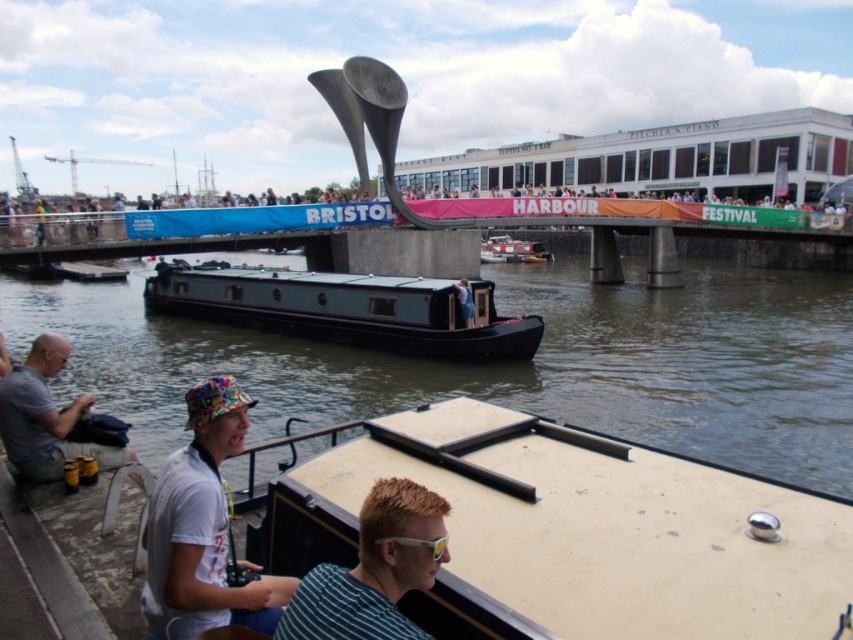
How distant is beige matte boat at lower center from dark gray fabric shirt at lower left?

They are 34.90 feet apart.

Does beige matte boat at lower center come in front of dark gray fabric shirt at lower left?

Yes, it is in front of dark gray fabric shirt at lower left.

Is point (506, 628) positioned behind point (53, 420)?

No, it is not.

This screenshot has width=853, height=640. I want to click on beige matte boat at lower center, so click(573, 531).

Is light brown striped shirt at lower center bigger than light blue fabric jacket at center?

Correct, light brown striped shirt at lower center is larger in size than light blue fabric jacket at center.

Does light brown striped shirt at lower center have a smaller size compared to light blue fabric jacket at center?

No, light brown striped shirt at lower center is not smaller than light blue fabric jacket at center.

The width and height of the screenshot is (853, 640). Identify the location of light brown striped shirt at lower center. (374, 570).

Is dark gray fabric shirt at lower left to the right of light blue fabric jacket at center from the viewer's perspective?

Incorrect, dark gray fabric shirt at lower left is not on the right side of light blue fabric jacket at center.

This screenshot has height=640, width=853. What do you see at coordinates (45, 417) in the screenshot?
I see `dark gray fabric shirt at lower left` at bounding box center [45, 417].

Which is in front, point (36, 456) or point (466, 307)?

Point (36, 456) is more forward.

The width and height of the screenshot is (853, 640). I want to click on dark gray fabric shirt at lower left, so click(x=45, y=417).